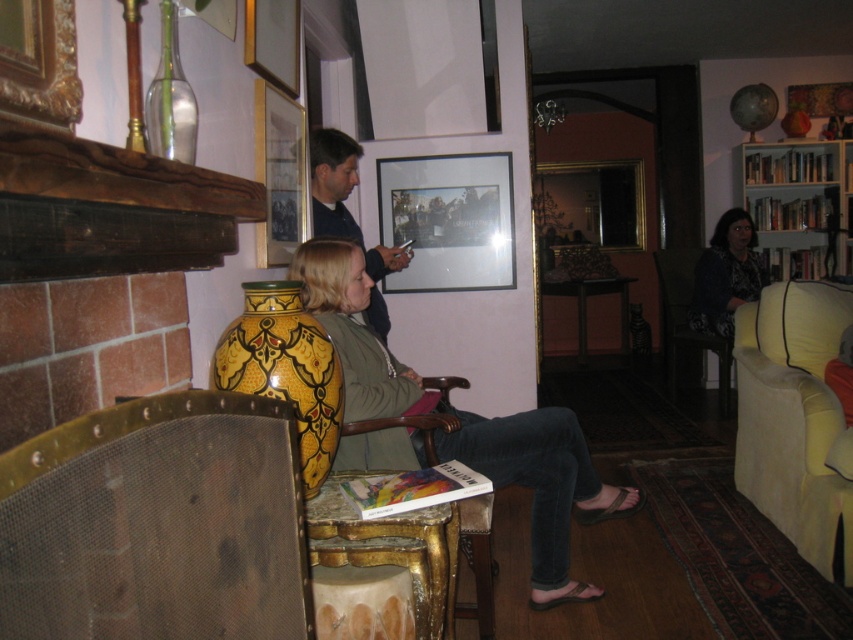
Question: Does white wooden bookshelf at right appear on the left side of matte black shirt at center?

Choices:
 (A) no
 (B) yes

Answer: (A)

Question: Which of the following is the closest to the observer?

Choices:
 (A) metallic mesh chair at lower left
 (B) matte glass picture frame at center
 (C) matte black shirt at center
 (D) dark floral dress at right

Answer: (A)

Question: Which point is farther from the camera taking this photo?

Choices:
 (A) (811, 200)
 (B) (434, 406)

Answer: (A)

Question: Does metallic mesh chair at lower left lie in front of dark floral dress at right?

Choices:
 (A) no
 (B) yes

Answer: (B)

Question: Which object appears closest to the camera in this image?

Choices:
 (A) yellow fabric couch at right
 (B) gold/gilded wood chair at center
 (C) metallic mesh chair at lower left

Answer: (C)

Question: Is dark floral dress at right to the right of velvet dark blue armchair at right from the viewer's perspective?

Choices:
 (A) no
 (B) yes

Answer: (B)